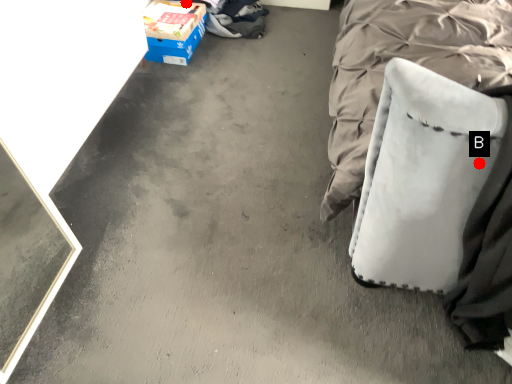
Question: Two points are circled on the image, labeled by A and B beside each circle. Which point is farther to the camera?

Choices:
 (A) A is further
 (B) B is further

Answer: (A)